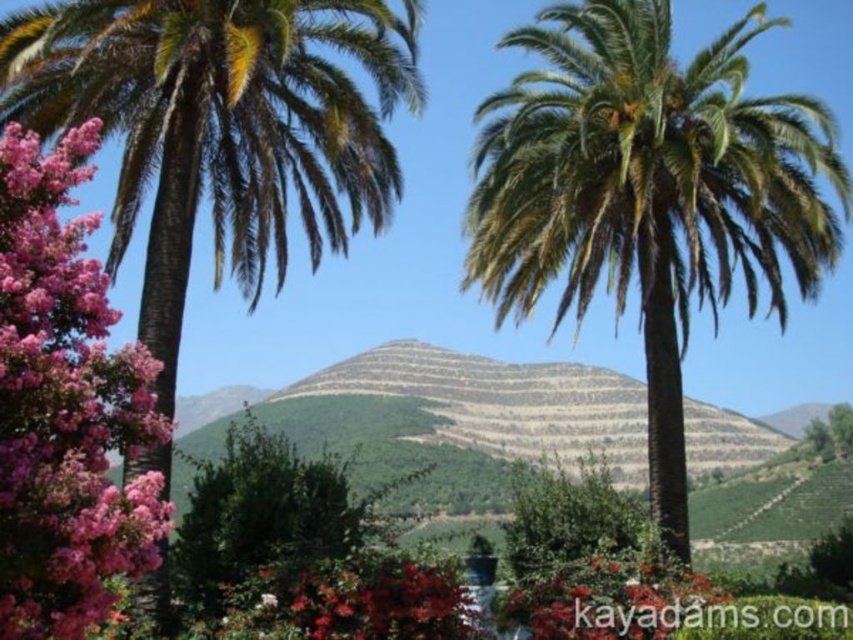
Question: Is green leafy palm tree at left bigger than vivid red petals at center?

Choices:
 (A) no
 (B) yes

Answer: (B)

Question: Among these points, which one is farthest from the camera?

Choices:
 (A) (518, 556)
 (B) (22, 216)
 (C) (39, 76)
 (D) (763, 211)

Answer: (A)

Question: In this image, where is pink fluffy flowers at left located relative to vivid red petals at center?

Choices:
 (A) above
 (B) below

Answer: (A)

Question: Which point appears farthest from the camera in this image?

Choices:
 (A) (657, 579)
 (B) (345, 13)

Answer: (A)

Question: Considering the real-world distances, which object is closest to the green leafy palm tree at left?

Choices:
 (A) vivid red petals at center
 (B) green leafy bush at center

Answer: (A)

Question: Can you confirm if pink fluffy flowers at left is positioned below green leafy bush at center?

Choices:
 (A) no
 (B) yes

Answer: (A)